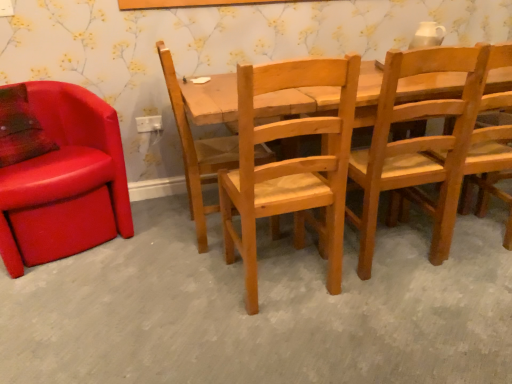
Image resolution: width=512 pixels, height=384 pixels. In order to click on vacant area that is in front of natural wood chair at center, which appears as the fourth chair when viewed from the right in this screenshot , I will do `click(188, 274)`.